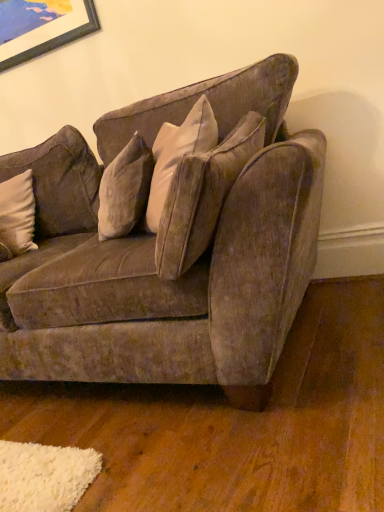
This screenshot has width=384, height=512. What do you see at coordinates (17, 216) in the screenshot? I see `white soft pillow at left` at bounding box center [17, 216].

In order to face white soft pillow at left, should I rotate leftwards or rightwards?

Turn left by 26.058 degrees to look at white soft pillow at left.

This screenshot has width=384, height=512. In order to click on white soft pillow at left in this screenshot , I will do `click(17, 216)`.

Measure the distance between velvet brown couch at center and camera.

35.75 inches.

Locate an element on the screen. The image size is (384, 512). velvet brown couch at center is located at coordinates (177, 252).

What do you see at coordinates (177, 252) in the screenshot? I see `velvet brown couch at center` at bounding box center [177, 252].

Locate an element on the screen. Image resolution: width=384 pixels, height=512 pixels. white soft pillow at left is located at coordinates coord(17,216).

Is white soft pillow at left to the right of velvet brown couch at center from the viewer's perspective?

In fact, white soft pillow at left is to the left of velvet brown couch at center.

In the image, is white soft pillow at left positioned in front of or behind velvet brown couch at center?

white soft pillow at left is positioned farther from the viewer than velvet brown couch at center.

Considering the points (24, 207) and (9, 306), which point is in front, point (24, 207) or point (9, 306)?

Point (9, 306)

From the image's perspective, between white soft pillow at left and velvet brown couch at center, which one is located above?

white soft pillow at left appears higher in the image.

From a real-world perspective, is white soft pillow at left positioned under velvet brown couch at center based on gravity?

No, from a real-world perspective, white soft pillow at left is not beneath velvet brown couch at center.

Does white soft pillow at left have a greater width compared to velvet brown couch at center?

No, white soft pillow at left is not wider than velvet brown couch at center.

In terms of height, does white soft pillow at left look taller or shorter compared to velvet brown couch at center?

In the image, white soft pillow at left appears to be shorter than velvet brown couch at center.

Consider the image. Considering the sizes of objects white soft pillow at left and velvet brown couch at center in the image provided, who is smaller, white soft pillow at left or velvet brown couch at center?

white soft pillow at left.

Based on the photo, is white soft pillow at left not within velvet brown couch at center?

No, white soft pillow at left is inside or overlapping with velvet brown couch at center.

Is white soft pillow at left directly adjacent to velvet brown couch at center?

No, white soft pillow at left is not beside velvet brown couch at center.

In the scene shown: Is white soft pillow at left oriented towards velvet brown couch at center?

Yes, white soft pillow at left is turned towards velvet brown couch at center.

Can you tell me how much white soft pillow at left and velvet brown couch at center differ in facing direction?

The facing directions of white soft pillow at left and velvet brown couch at center are 18.9 degrees apart.

Locate an element on the screen. pillow positioned vertically above the velvet brown couch at center (from a real-world perspective) is located at coordinates [x=17, y=216].

Can you confirm if velvet brown couch at center is positioned to the right of white soft pillow at left?

Correct, you'll find velvet brown couch at center to the right of white soft pillow at left.

Which object is closer to the camera, velvet brown couch at center or white soft pillow at left?

velvet brown couch at center is closer to the camera.

Which is less distant, (247,140) or (32,179)?

Clearly, point (247,140) is closer to the camera than point (32,179).

From the image's perspective, relative to white soft pillow at left, is velvet brown couch at center above or below?

Based on their image positions, velvet brown couch at center is located beneath white soft pillow at left.

From the picture: From a real-world perspective, is velvet brown couch at center on white soft pillow at left?

No, from a real-world perspective, velvet brown couch at center is not over white soft pillow at left

Is velvet brown couch at center wider than white soft pillow at left?

Indeed, velvet brown couch at center has a greater width compared to white soft pillow at left.

Who is taller, velvet brown couch at center or white soft pillow at left?

velvet brown couch at center is taller.

Which of these two, velvet brown couch at center or white soft pillow at left, is bigger?

With larger size is velvet brown couch at center.

Do you think velvet brown couch at center is within white soft pillow at left, or outside of it?

velvet brown couch at center is spatially situated outside white soft pillow at left.

Is velvet brown couch at center in contact with white soft pillow at left?

velvet brown couch at center is not next to white soft pillow at left, and they're not touching.

Is velvet brown couch at center looking in the opposite direction of white soft pillow at left?

Correct, velvet brown couch at center is looking away from white soft pillow at left.

Can you tell me how much velvet brown couch at center and white soft pillow at left differ in facing direction?

The angle between the facing direction of velvet brown couch at center and the facing direction of white soft pillow at left is 18.9 degrees.

In order to click on pillow above the velvet brown couch at center (from a real-world perspective) in this screenshot , I will do `click(17, 216)`.

The width and height of the screenshot is (384, 512). Identify the location of pillow on the left of velvet brown couch at center. (17, 216).

Where is `studio couch that appears in front of the white soft pillow at left`? studio couch that appears in front of the white soft pillow at left is located at coordinates (177, 252).